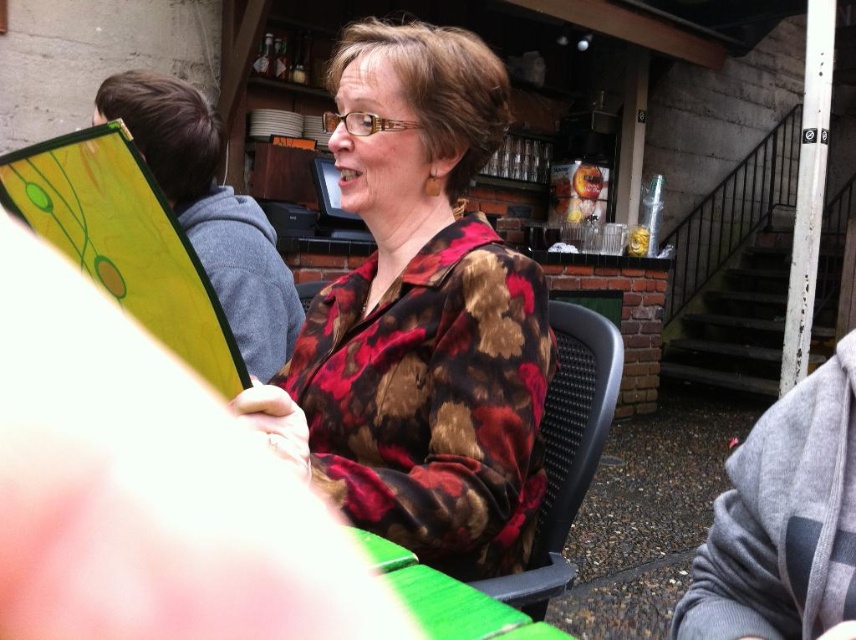
Does floral-patterned shirt at center appear on the left side of black mesh chair at center?

Correct, you'll find floral-patterned shirt at center to the left of black mesh chair at center.

What do you see at coordinates (420, 316) in the screenshot? I see `floral-patterned shirt at center` at bounding box center [420, 316].

Where is `floral-patterned shirt at center`? Image resolution: width=856 pixels, height=640 pixels. floral-patterned shirt at center is located at coordinates (420, 316).